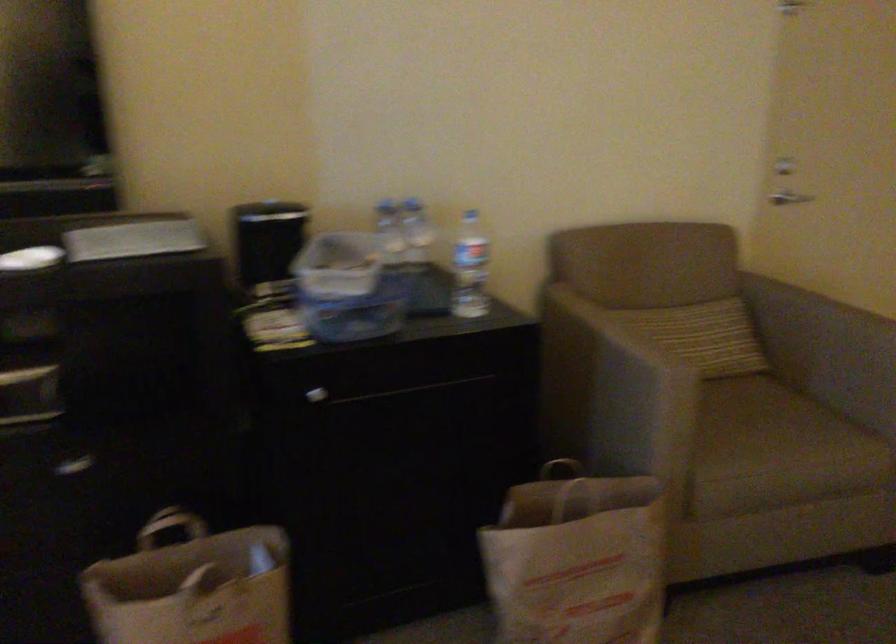
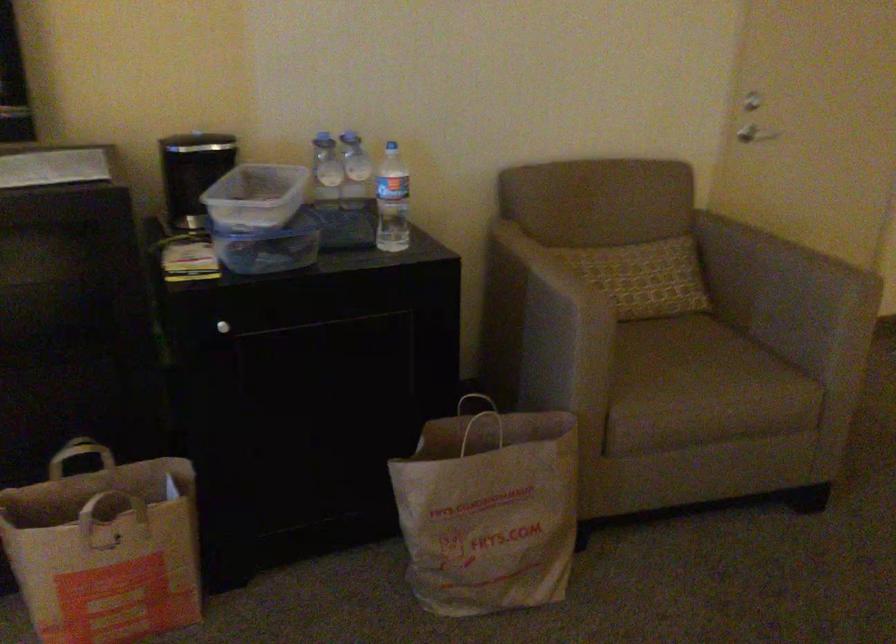
Locate, in the second image, the point that corresponds to (472,267) in the first image.

(391, 201)